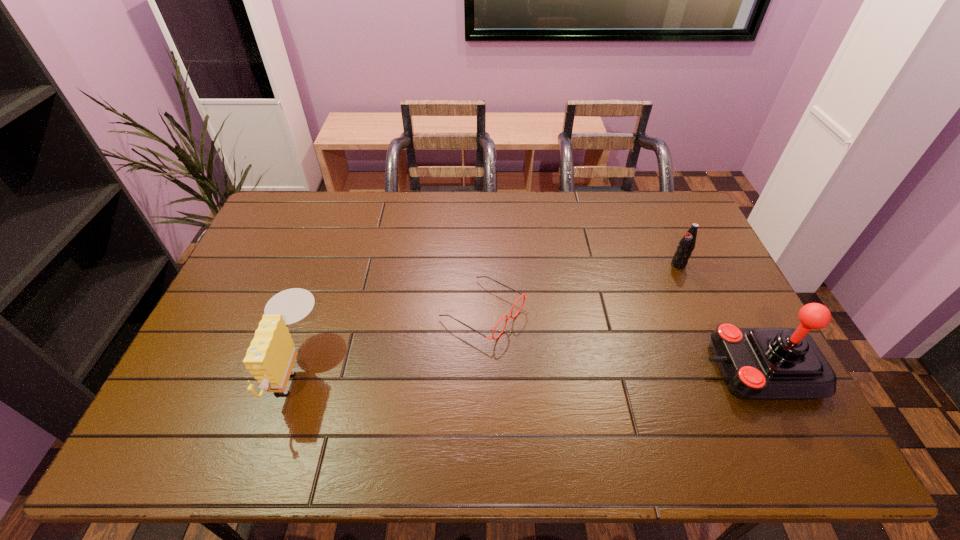
The width and height of the screenshot is (960, 540). Find the location of `joystick situated at the near edge`. joystick situated at the near edge is located at coordinates (756, 363).

Image resolution: width=960 pixels, height=540 pixels. Find the location of `joystick that is at the right edge`. joystick that is at the right edge is located at coordinates (756, 363).

At what (x,y) coordinates should I click in order to perform the action: click on pop that is at the right edge. Please return your answer as a coordinate pair (x, y). Looking at the image, I should click on (686, 245).

This screenshot has height=540, width=960. Find the location of `object that is at the near right corner`. object that is at the near right corner is located at coordinates (756, 363).

Where is `free space at the far edge of the desktop`? free space at the far edge of the desktop is located at coordinates (397, 218).

In order to click on free space at the near edge of the desktop in this screenshot , I will do `click(449, 394)`.

Where is `free region at the left edge`? free region at the left edge is located at coordinates (281, 258).

The image size is (960, 540). Find the location of `free space at the right edge of the desktop`. free space at the right edge of the desktop is located at coordinates (711, 370).

You are a GUI agent. You are given a task and a screenshot of the screen. Output one action in this format:
    pyautogui.click(x=<x>, y=<y>)
    Task: Click on the vacant area at the far left corner of the desktop
    
    Given the screenshot: What is the action you would take?
    pyautogui.click(x=309, y=214)

Find the location of a particular element. This screenshot has width=960, height=540. vacant position at the near left corner of the desktop is located at coordinates (231, 395).